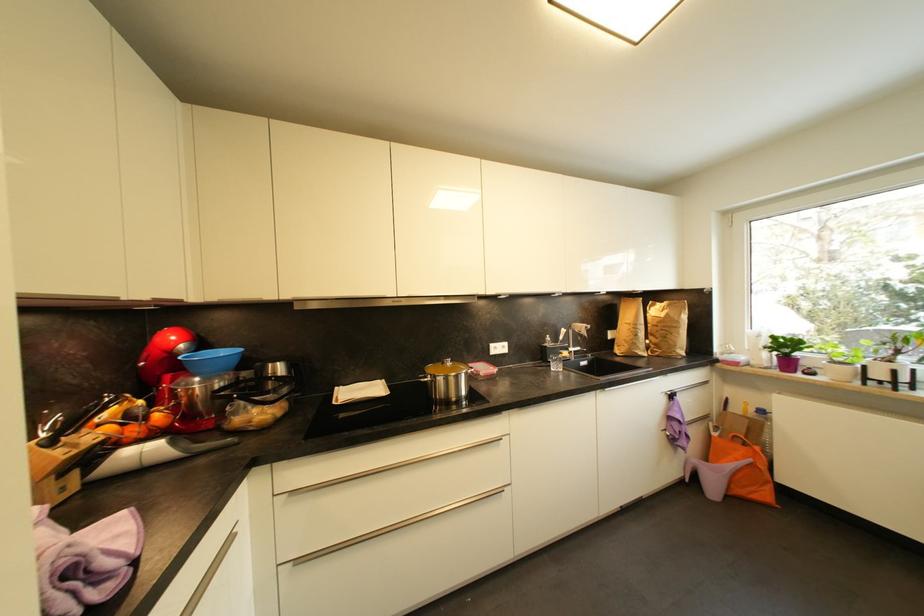
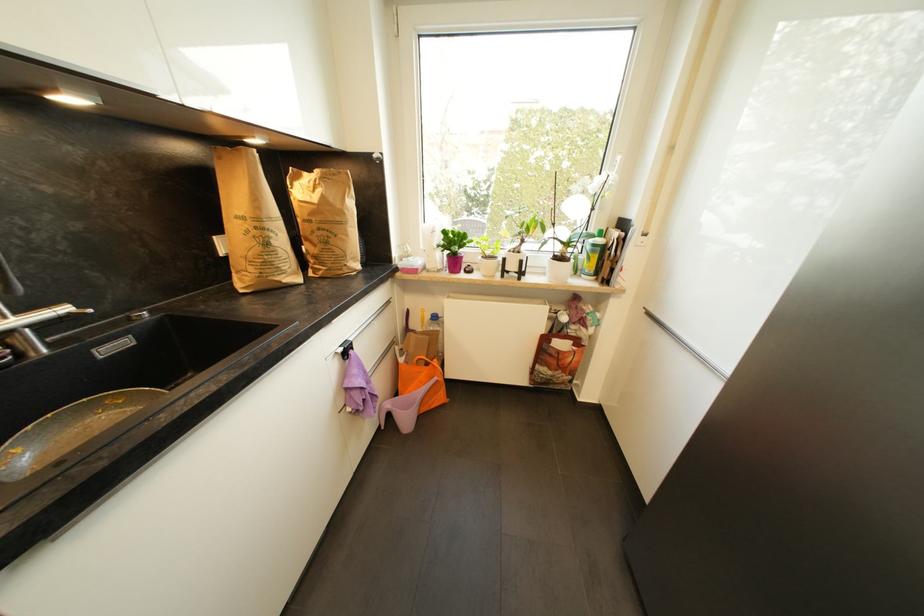
Where in the second image is the point corresponding to [640,337] from the first image?

(272, 246)